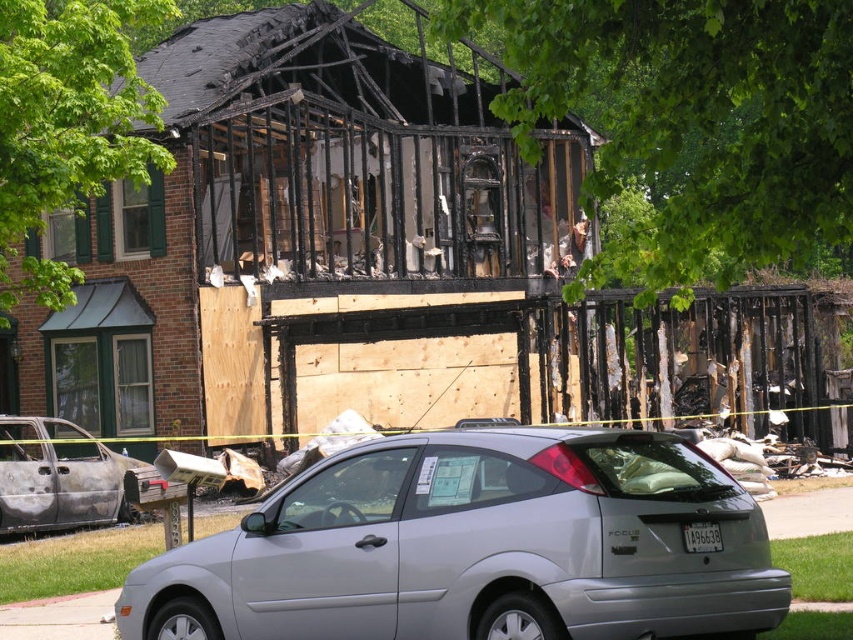
Does silver metallic hatchback at center have a lesser width compared to burnt metallic car at lower left?

No.

Between silver metallic hatchback at center and burnt metallic car at lower left, which one has more height?

Standing taller between the two is burnt metallic car at lower left.

What do you see at coordinates (479, 547) in the screenshot?
I see `silver metallic hatchback at center` at bounding box center [479, 547].

You are a GUI agent. You are given a task and a screenshot of the screen. Output one action in this format:
    pyautogui.click(x=<x>, y=<y>)
    Task: Click on the silver metallic hatchback at center
    Image resolution: width=853 pixels, height=640 pixels.
    Given the screenshot: What is the action you would take?
    pyautogui.click(x=479, y=547)